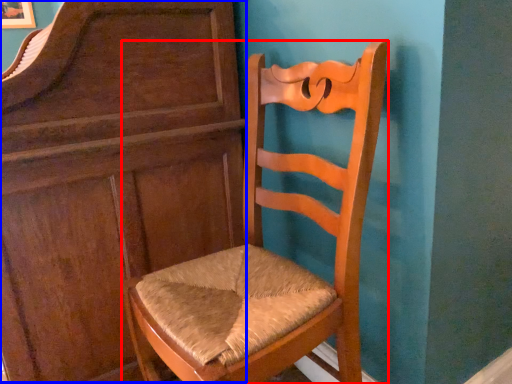
Question: Which object appears farthest to the camera in this image, chair (highlighted by a red box) or dresser (highlighted by a blue box)?

Choices:
 (A) chair
 (B) dresser

Answer: (B)